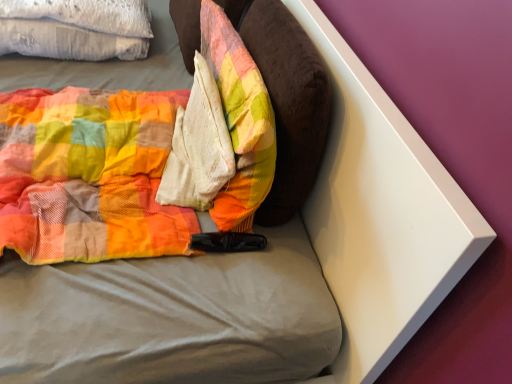
At what (x,y) coordinates should I click in order to perform the action: click on velvety brown pillow at center, marked as the 1th pillow in a right-to-left arrangement. Please return your answer as a coordinate pair (x, y). The height and width of the screenshot is (384, 512). Looking at the image, I should click on (287, 100).

The height and width of the screenshot is (384, 512). What do you see at coordinates (75, 28) in the screenshot?
I see `white textured pillow at upper left` at bounding box center [75, 28].

Image resolution: width=512 pixels, height=384 pixels. Find the location of `velvety brown pillow at center, marked as the 1th pillow in a right-to-left arrangement`. velvety brown pillow at center, marked as the 1th pillow in a right-to-left arrangement is located at coordinates (287, 100).

Can you confirm if white textured pillow at center is taller than plush fabric pillow at center, placed as the 2th pillow when sorted from right to left?

Incorrect, the height of white textured pillow at center is not larger of that of plush fabric pillow at center, placed as the 2th pillow when sorted from right to left.

Does white textured pillow at center have a greater width compared to plush fabric pillow at center, which is counted as the first pillow, starting from the left?

Indeed, white textured pillow at center has a greater width compared to plush fabric pillow at center, which is counted as the first pillow, starting from the left.

Find the location of a particular element. The width and height of the screenshot is (512, 384). material behind the plush fabric pillow at center, placed as the 2th pillow when sorted from right to left is located at coordinates (198, 147).

From the image's perspective, is white textured pillow at center located above plush fabric pillow at center, placed as the 2th pillow when sorted from right to left?

Actually, white textured pillow at center appears below plush fabric pillow at center, placed as the 2th pillow when sorted from right to left, in the image.

Based on the photo, from a real-world perspective, does white textured pillow at center sit lower than velvety brown pillow at center, marked as the 1th pillow in a right-to-left arrangement?

Correct, in the physical world, white textured pillow at center is lower than velvety brown pillow at center, marked as the 1th pillow in a right-to-left arrangement.

Is white textured pillow at center positioned with its back to velvety brown pillow at center, the 2th pillow in the left-to-right sequence?

Yes, velvety brown pillow at center, the 2th pillow in the left-to-right sequence, is at the back of white textured pillow at center.

Which pillow is the 2nd one when counting from the right side of the white textured pillow at center? Please provide its 2D coordinates.

[(287, 100)]

From the image's perspective, is white textured pillow at center located above or below velvety brown pillow at center, marked as the 1th pillow in a right-to-left arrangement?

white textured pillow at center is situated lower than velvety brown pillow at center, marked as the 1th pillow in a right-to-left arrangement, in the image.

Identify the location of pillow that is the 2nd object above the white textured pillow at upper left (from a real-world perspective). This screenshot has height=384, width=512. (287, 100).

Is velvety brown pillow at center, marked as the 1th pillow in a right-to-left arrangement, oriented towards white textured pillow at upper left?

No, velvety brown pillow at center, marked as the 1th pillow in a right-to-left arrangement, does not turn towards white textured pillow at upper left.

Is velvety brown pillow at center, marked as the 1th pillow in a right-to-left arrangement, beside white textured pillow at upper left?

velvety brown pillow at center, marked as the 1th pillow in a right-to-left arrangement, is not next to white textured pillow at upper left, and they're not touching.

Is velvety brown pillow at center, the 2th pillow in the left-to-right sequence, further to the viewer compared to white textured pillow at upper left?

That is False.

The image size is (512, 384). In order to click on material above the white textured pillow at upper left (from a real-world perspective) in this screenshot , I will do `click(198, 147)`.

Is white textured pillow at center far from white textured pillow at upper left?

No, there isn't a large distance between white textured pillow at center and white textured pillow at upper left.

Is white textured pillow at upper left at the back of white textured pillow at center?

No, white textured pillow at upper left is not at the back of white textured pillow at center.

Does point (162, 192) appear closer or farther from the camera than point (42, 29)?

Clearly, point (162, 192) is closer to the camera than point (42, 29).

Considering the points (6, 35) and (245, 126), which point is behind, point (6, 35) or point (245, 126)?

The point (6, 35) is farther.

Can you confirm if white textured pillow at upper left is thinner than plush fabric pillow at center, placed as the 2th pillow when sorted from right to left?

No, white textured pillow at upper left is not thinner than plush fabric pillow at center, placed as the 2th pillow when sorted from right to left.

What are the coordinates of `cloth above the plush fabric pillow at center, which is counted as the first pillow, starting from the left (from the image's perspective)` in the screenshot? It's located at (75, 28).

Is white textured pillow at upper left bigger than plush fabric pillow at center, which is counted as the first pillow, starting from the left?

Yes, white textured pillow at upper left is bigger than plush fabric pillow at center, which is counted as the first pillow, starting from the left.

Considering the relative sizes of plush fabric pillow at center, placed as the 2th pillow when sorted from right to left, and velvety brown pillow at center, the 2th pillow in the left-to-right sequence, in the image provided, is plush fabric pillow at center, placed as the 2th pillow when sorted from right to left, shorter than velvety brown pillow at center, the 2th pillow in the left-to-right sequence,?

Correct, plush fabric pillow at center, placed as the 2th pillow when sorted from right to left, is not as tall as velvety brown pillow at center, the 2th pillow in the left-to-right sequence.

Which is behind, point (223, 217) or point (180, 17)?

Point (180, 17)

Does plush fabric pillow at center, placed as the 2th pillow when sorted from right to left, come behind velvety brown pillow at center, the 2th pillow in the left-to-right sequence?

That is False.

Which is more to the right, plush fabric pillow at center, which is counted as the first pillow, starting from the left, or velvety brown pillow at center, marked as the 1th pillow in a right-to-left arrangement?

velvety brown pillow at center, marked as the 1th pillow in a right-to-left arrangement, is more to the right.

Which is more to the right, white textured pillow at upper left or white textured pillow at center?

white textured pillow at center.

Which object is closer to the camera, white textured pillow at upper left or white textured pillow at center?

white textured pillow at center.

From a real-world perspective, between white textured pillow at upper left and white textured pillow at center, who is vertically higher?

In real-world perspective, white textured pillow at center is above.

In the image, there is a plush fabric pillow at center, which is counted as the first pillow, starting from the left. Find the location of `material below it (from a real-world perspective)`. material below it (from a real-world perspective) is located at coordinates (198, 147).

I want to click on material located behind the velvety brown pillow at center, marked as the 1th pillow in a right-to-left arrangement, so click(198, 147).

Consider the image. Which object lies nearer to the anchor point velvety brown pillow at center, marked as the 1th pillow in a right-to-left arrangement, white textured pillow at upper left or plush fabric pillow at center, which is counted as the first pillow, starting from the left?

Among the two, plush fabric pillow at center, which is counted as the first pillow, starting from the left, is located nearer to velvety brown pillow at center, marked as the 1th pillow in a right-to-left arrangement.

Based on the photo, based on their spatial positions, is white textured pillow at center or plush fabric pillow at center, placed as the 2th pillow when sorted from right to left, further from white textured pillow at upper left?

plush fabric pillow at center, placed as the 2th pillow when sorted from right to left, is positioned further to the anchor white textured pillow at upper left.

Considering their positions, is plush fabric pillow at center, which is counted as the first pillow, starting from the left, positioned closer to white textured pillow at upper left than white textured pillow at center?

Among the two, white textured pillow at center is located nearer to white textured pillow at upper left.

Looking at the image, which one is located further to plush fabric pillow at center, which is counted as the first pillow, starting from the left, white textured pillow at center or white textured pillow at upper left?

white textured pillow at upper left.

Based on their spatial positions, is plush fabric pillow at center, placed as the 2th pillow when sorted from right to left, or white textured pillow at upper left closer to white textured pillow at center?

plush fabric pillow at center, placed as the 2th pillow when sorted from right to left.

Considering their positions, is velvety brown pillow at center, marked as the 1th pillow in a right-to-left arrangement, positioned further to plush fabric pillow at center, which is counted as the first pillow, starting from the left, than white textured pillow at upper left?

The object further to plush fabric pillow at center, which is counted as the first pillow, starting from the left, is white textured pillow at upper left.

Based on their spatial positions, is white textured pillow at upper left or velvety brown pillow at center, marked as the 1th pillow in a right-to-left arrangement, closer to plush fabric pillow at center, placed as the 2th pillow when sorted from right to left?

velvety brown pillow at center, marked as the 1th pillow in a right-to-left arrangement.

Estimate the real-world distances between objects in this image. Which object is closer to plush fabric pillow at center, placed as the 2th pillow when sorted from right to left, velvety brown pillow at center, the 2th pillow in the left-to-right sequence, or white textured pillow at center?

The object closer to plush fabric pillow at center, placed as the 2th pillow when sorted from right to left, is white textured pillow at center.

This screenshot has width=512, height=384. Find the location of `pillow situated between white textured pillow at upper left and velvety brown pillow at center, the 2th pillow in the left-to-right sequence, from left to right`. pillow situated between white textured pillow at upper left and velvety brown pillow at center, the 2th pillow in the left-to-right sequence, from left to right is located at coordinates (239, 120).

I want to click on pillow between white textured pillow at center and velvety brown pillow at center, the 2th pillow in the left-to-right sequence, so click(x=239, y=120).

You are a GUI agent. You are given a task and a screenshot of the screen. Output one action in this format:
    pyautogui.click(x=<x>, y=<y>)
    Task: Click on the material between white textured pillow at upper left and velvety brown pillow at center, marked as the 1th pillow in a right-to-left arrangement
    The width and height of the screenshot is (512, 384).
    Given the screenshot: What is the action you would take?
    pyautogui.click(x=198, y=147)

Identify the location of material located between white textured pillow at upper left and plush fabric pillow at center, placed as the 2th pillow when sorted from right to left, in the left-right direction. (198, 147).